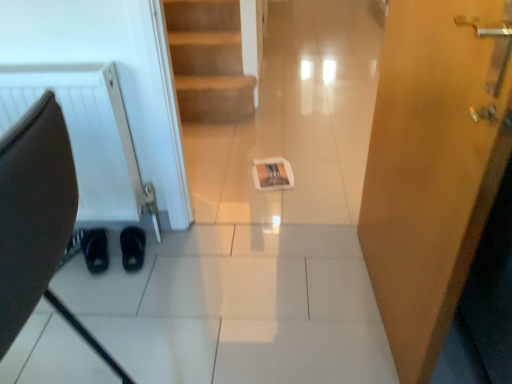
Find the location of a particular element. This screenshot has width=512, height=384. vacant area that is situated to the right of matte paper magazine at center is located at coordinates (317, 175).